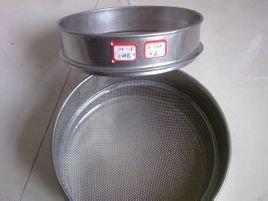
In order to click on gap between floor and wall in this screenshot , I will do `click(46, 133)`.